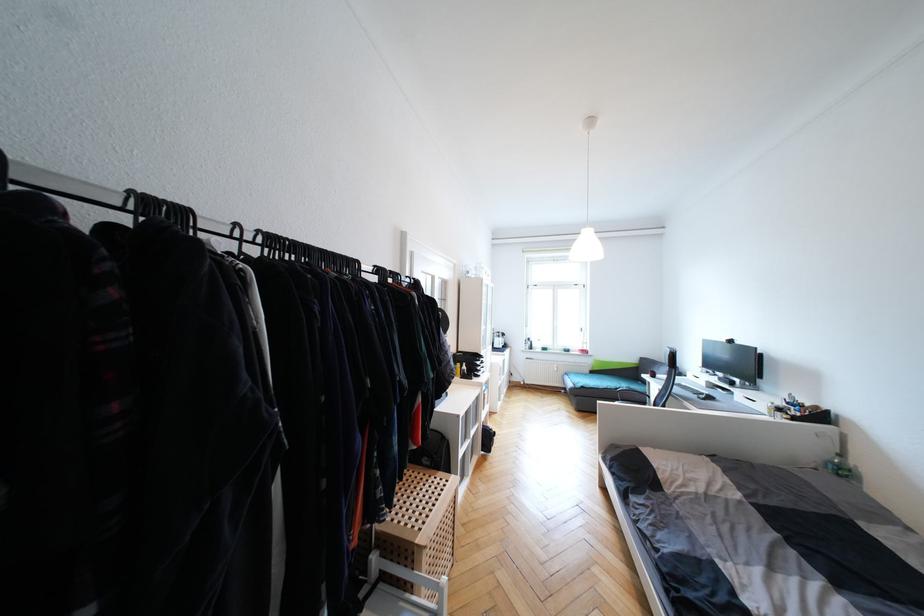
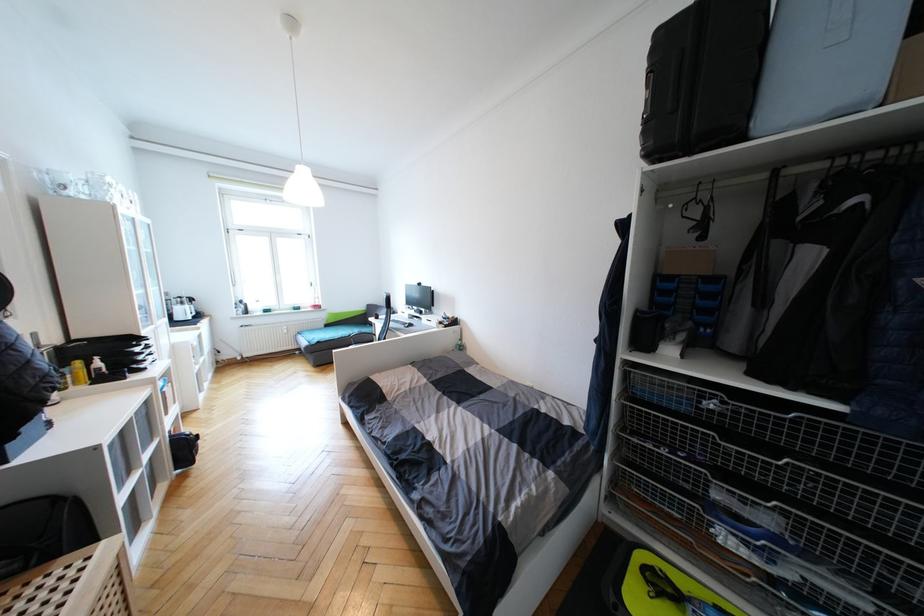
Question: The images are taken continuously from a first-person perspective. In which direction is your viewpoint rotating?

Choices:
 (A) Left
 (B) Right
 (C) Up
 (D) Down

Answer: (B)